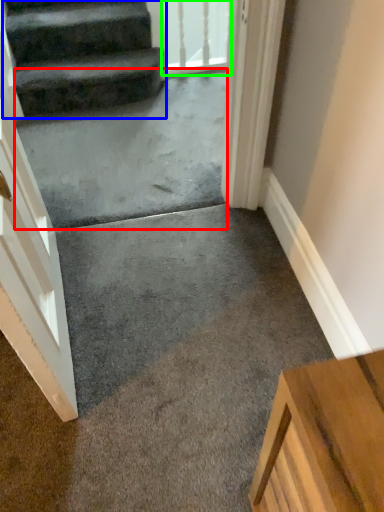
Question: Which is nearer to the concrete (highlighted by a red box)? stairs (highlighted by a blue box) or glass door (highlighted by a green box).

Choices:
 (A) stairs
 (B) glass door

Answer: (A)